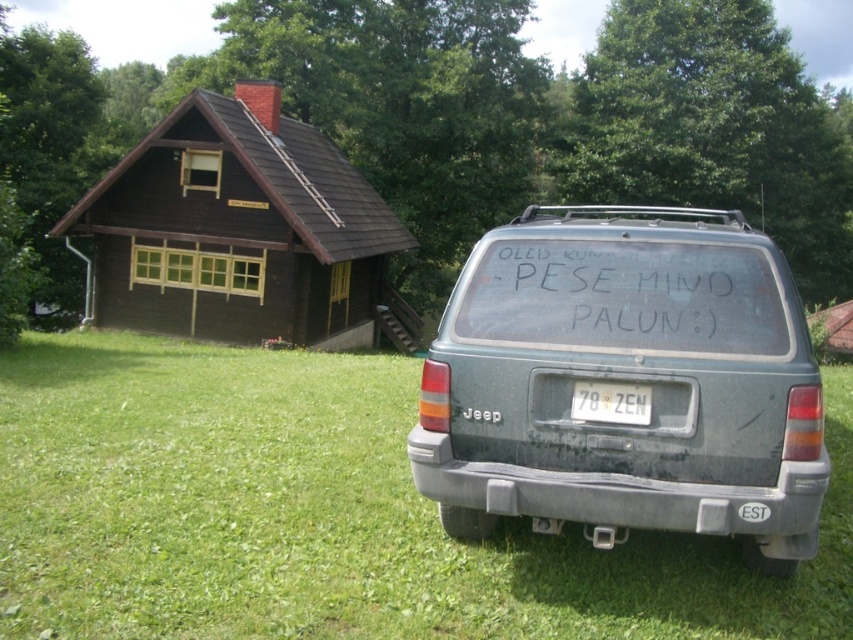
Based on the photo, is the position of black matte text at rear more distant than that of white plastic license plate at center?

No, black matte text at rear is in front of white plastic license plate at center.

Is point (527, 275) less distant than point (613, 388)?

No, it is not.

Which is behind, point (639, 253) or point (641, 406)?

Point (639, 253)

Find the location of a particular element. This screenshot has height=640, width=853. black matte text at rear is located at coordinates (611, 294).

Measure the distance from green grass at center to matte gray suv at right.

green grass at center and matte gray suv at right are 16.31 feet apart from each other.

Which is above, green grass at center or matte gray suv at right?

matte gray suv at right is above.

Find the location of a particular element. green grass at center is located at coordinates (x=325, y=513).

Which is behind, point (769, 608) or point (631, 292)?

The point (769, 608) is more distant.

Does green grass at center have a lesser width compared to black matte text at rear?

No.

What do you see at coordinates (325, 513) in the screenshot? I see `green grass at center` at bounding box center [325, 513].

At what (x,y) coordinates should I click in order to perform the action: click on green grass at center. Please return your answer as a coordinate pair (x, y). This screenshot has width=853, height=640. Looking at the image, I should click on (325, 513).